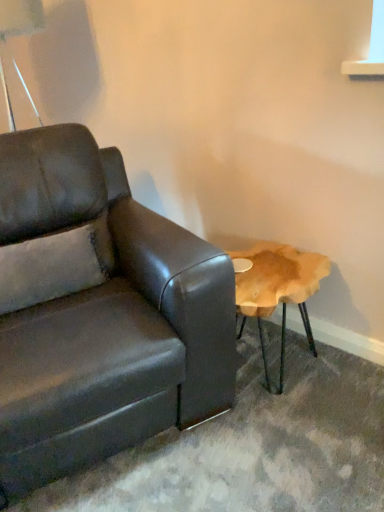
Question: From a real-world perspective, is matte leather couch at left positioned above or below metallic silver table lamp at upper left?

Choices:
 (A) below
 (B) above

Answer: (A)

Question: Considering the positions of point (114, 158) and point (6, 26), is point (114, 158) closer or farther from the camera than point (6, 26)?

Choices:
 (A) closer
 (B) farther

Answer: (B)

Question: In terms of height, does matte leather couch at left look taller or shorter compared to metallic silver table lamp at upper left?

Choices:
 (A) tall
 (B) short

Answer: (A)

Question: Considering the positions of metallic silver table lamp at upper left and matte leather couch at left in the image, is metallic silver table lamp at upper left taller or shorter than matte leather couch at left?

Choices:
 (A) tall
 (B) short

Answer: (B)

Question: Is metallic silver table lamp at upper left spatially inside matte leather couch at left, or outside of it?

Choices:
 (A) outside
 (B) inside

Answer: (A)

Question: From the image's perspective, is metallic silver table lamp at upper left above or below matte leather couch at left?

Choices:
 (A) above
 (B) below

Answer: (A)

Question: Based on their positions, is metallic silver table lamp at upper left located to the left or right of matte leather couch at left?

Choices:
 (A) left
 (B) right

Answer: (A)